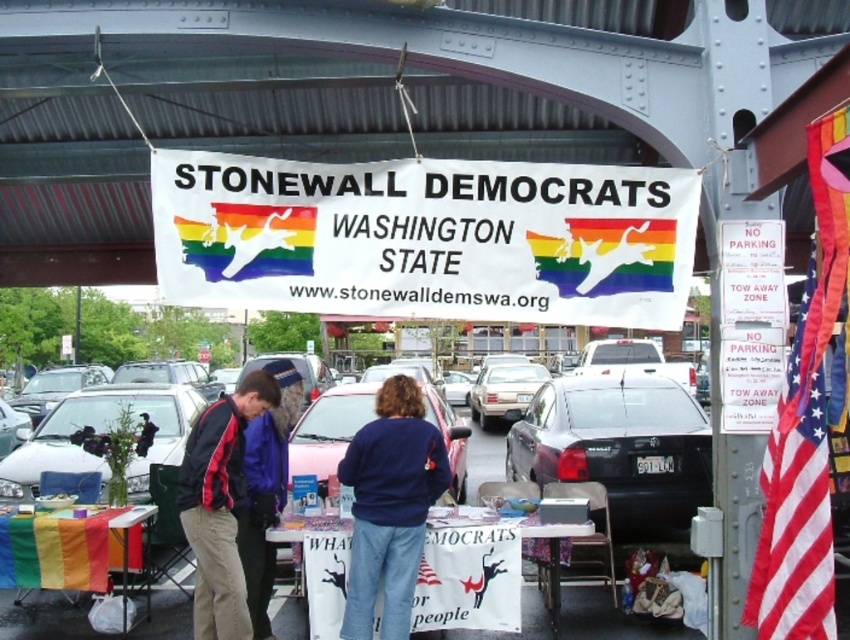
Question: Which point is farther to the camera?

Choices:
 (A) (114, 404)
 (B) (250, 20)
 (C) (581, 403)
 (D) (508, 364)

Answer: (D)

Question: Considering the real-world distances, which object is farthest from the white glossy car at lower left?

Choices:
 (A) blue fleece jacket at center
 (B) red and black jacket at center

Answer: (A)

Question: Can you confirm if black glossy sedan at center is positioned to the right of red and black jacket at center?

Choices:
 (A) no
 (B) yes

Answer: (B)

Question: Observing the image, what is the correct spatial positioning of blue fleece jacket at center in reference to matte silver sedan at center?

Choices:
 (A) above
 (B) below

Answer: (A)

Question: Is white metal overpass at upper center to the left of white glossy car at lower left from the viewer's perspective?

Choices:
 (A) no
 (B) yes

Answer: (A)

Question: Among these objects, which one is nearest to the camera?

Choices:
 (A) white glossy car at lower left
 (B) black glossy sedan at center

Answer: (B)